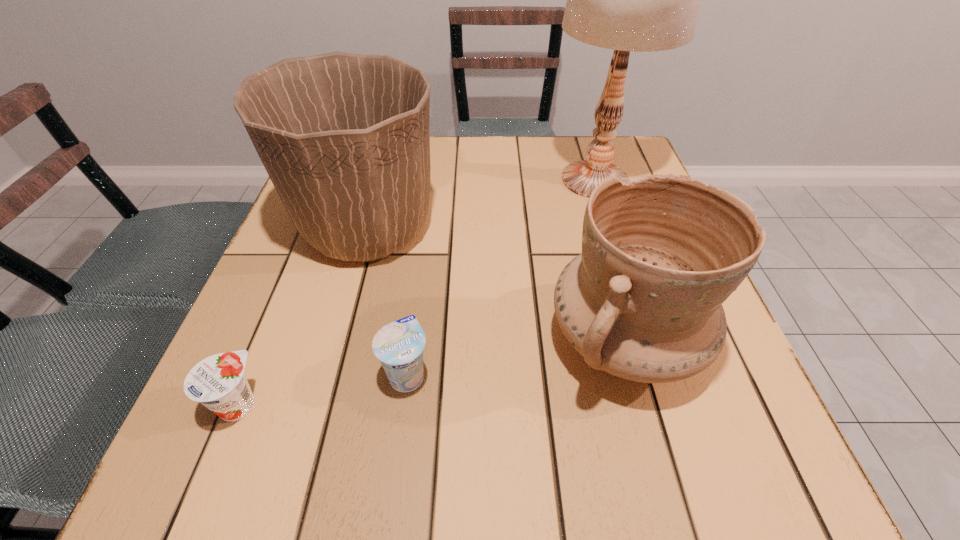
Image resolution: width=960 pixels, height=540 pixels. Identify the location of lamp. (642, 0).

This screenshot has height=540, width=960. I want to click on flowerpot, so click(x=344, y=137).

The width and height of the screenshot is (960, 540). Find the location of `pottery`. pottery is located at coordinates (660, 254).

Locate an element on the screen. the right yogurt is located at coordinates (399, 345).

What are the coordinates of `the shortest object` in the screenshot? It's located at tap(218, 382).

The height and width of the screenshot is (540, 960). I want to click on the shorter yogurt, so click(x=218, y=382).

Locate an element on the screen. vacant area located 0.110m on the left of the tallest object is located at coordinates (499, 180).

In order to click on vacant space located on the front of the flowerpot in this screenshot , I will do `click(347, 301)`.

What are the coordinates of `vacant space located 0.090m on the left of the pottery` in the screenshot? It's located at (495, 340).

Find the location of a particular element. The image size is (960, 540). vacant region located on the back of the right yogurt is located at coordinates (422, 257).